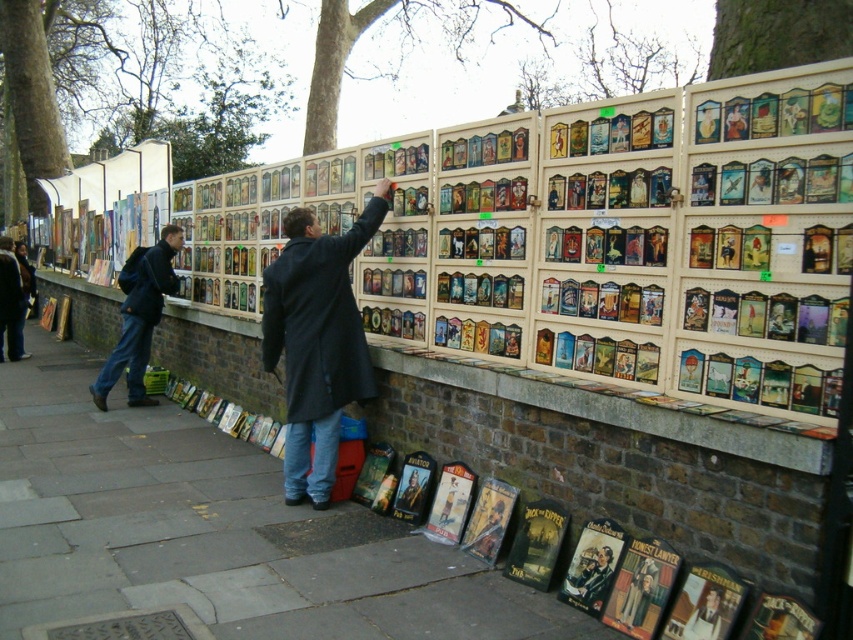
Between point (703, 595) and point (403, 497), which one is positioned behind?

The point (403, 497) is more distant.

Can you confirm if matte black poster at center is taller than matte black coat at center?

Incorrect, matte black poster at center's height is not larger of matte black coat at center's.

This screenshot has width=853, height=640. What do you see at coordinates (704, 614) in the screenshot?
I see `matte black poster at center` at bounding box center [704, 614].

Where is `matte black poster at center`? This screenshot has height=640, width=853. matte black poster at center is located at coordinates (704, 614).

Can you confirm if concrete pavement at lower center is bigger than matte black poster at center?

No, concrete pavement at lower center is not bigger than matte black poster at center.

Does concrete pavement at lower center have a smaller size compared to matte black poster at center?

Yes.

Which is behind, point (62, 512) or point (706, 582)?

The point (62, 512) is more distant.

This screenshot has height=640, width=853. I want to click on concrete pavement at lower center, so click(210, 529).

Can you confirm if dark blue coat at center is positioned to the left of matte black book at lower center?

Correct, you'll find dark blue coat at center to the left of matte black book at lower center.

Between dark blue coat at center and matte black book at lower center, which one appears on the left side from the viewer's perspective?

dark blue coat at center is more to the left.

Between point (285, 394) and point (576, 576), which one is positioned in front?

Positioned in front is point (576, 576).

Where is `dark blue coat at center`? This screenshot has height=640, width=853. dark blue coat at center is located at coordinates (317, 340).